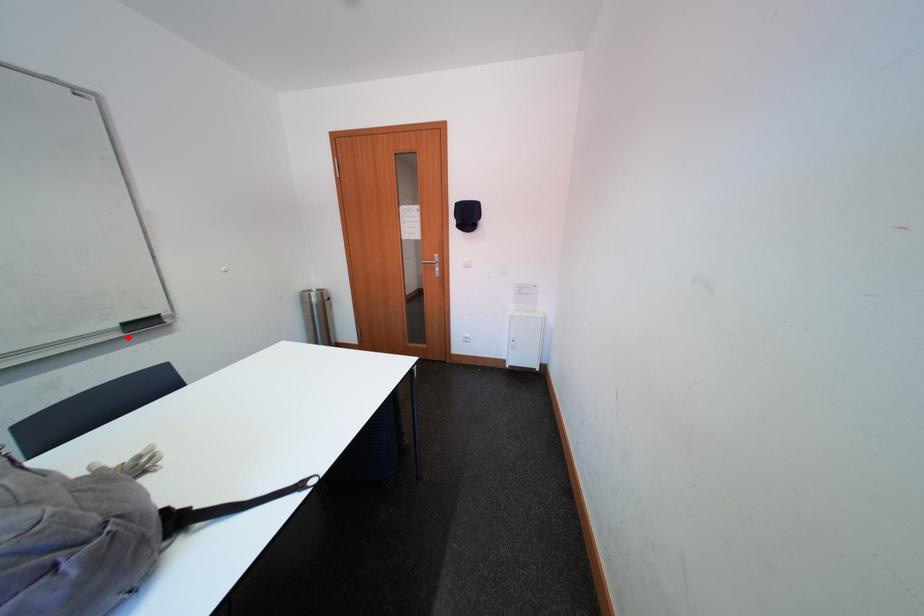
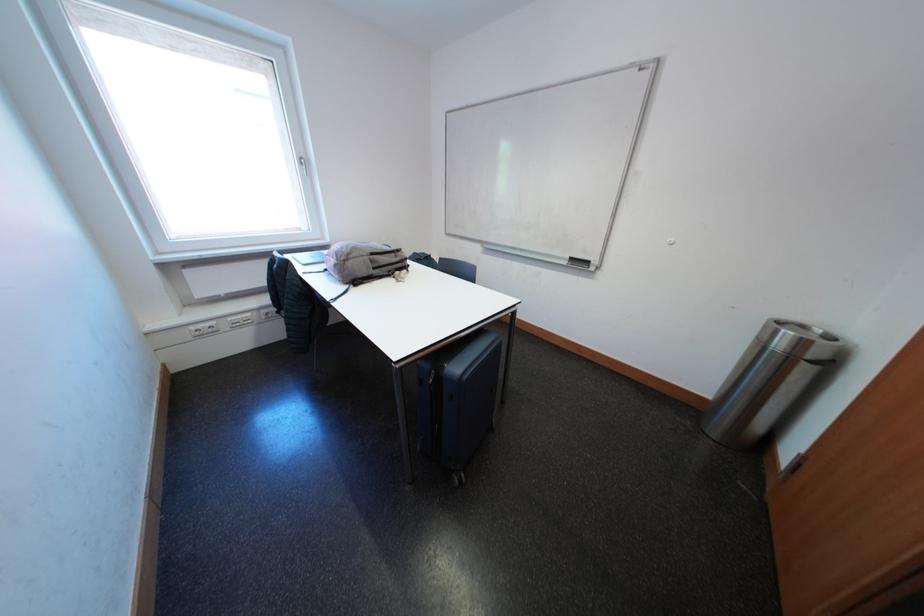
Find the pixel in the second image that matches the highlighted location in the first image.

(575, 267)